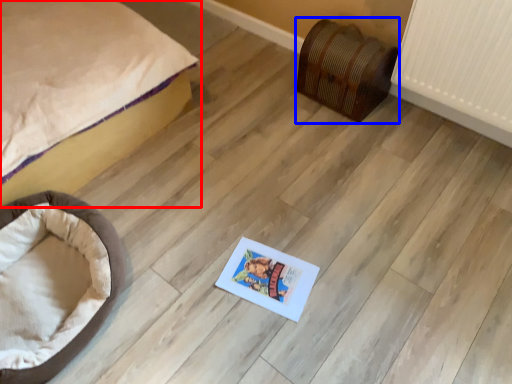
Question: Which point is further to the camera, bed (highlighted by a red box) or furniture (highlighted by a blue box)?

Choices:
 (A) bed
 (B) furniture

Answer: (B)